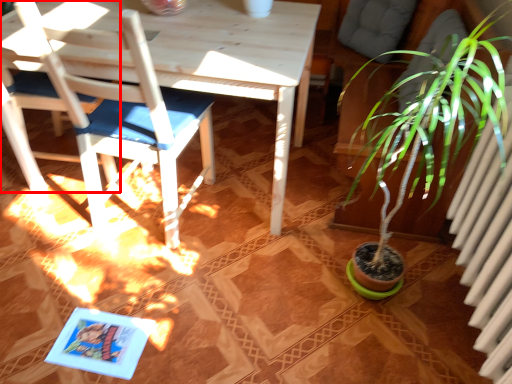
Question: From the image's perspective, where is chair (annotated by the red box) located in relation to chair in the image?

Choices:
 (A) below
 (B) above

Answer: (B)